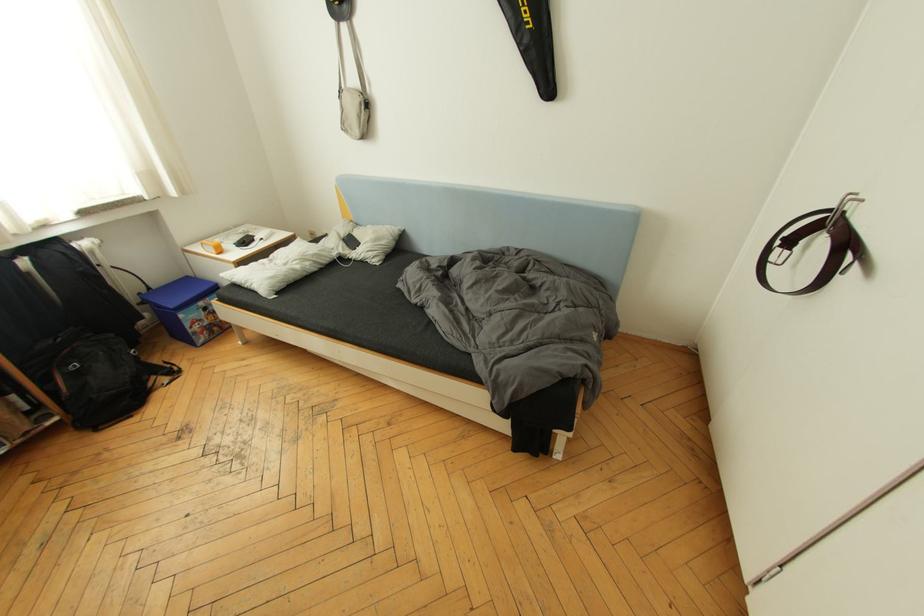
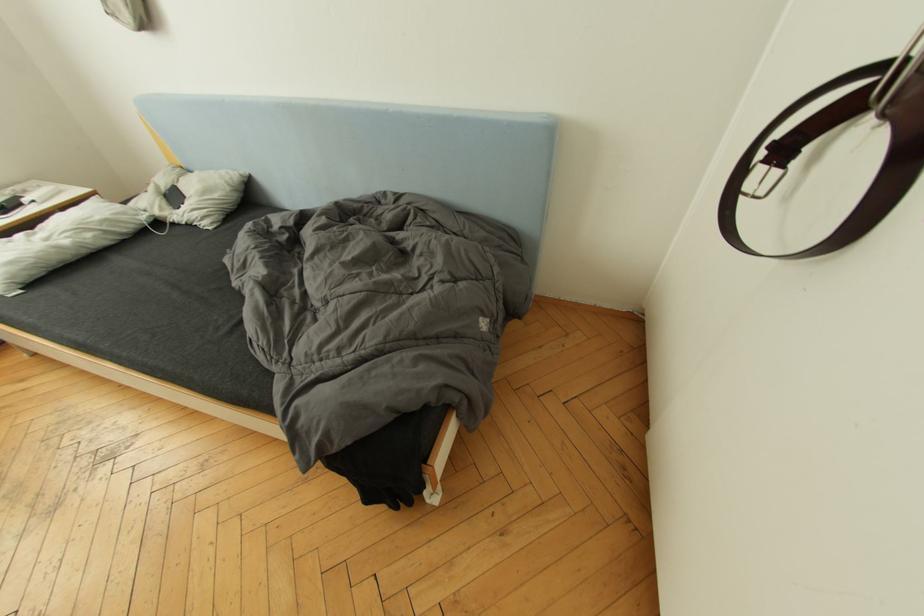
Question: The images are taken continuously from a first-person perspective. In which direction is your viewpoint rotating?

Choices:
 (A) Left
 (B) Right
 (C) Up
 (D) Down

Answer: (D)